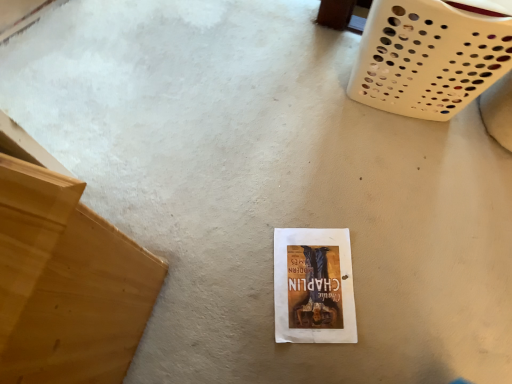
Locate an element on the screen. free space between light brown wood at left and white plastic basket at upper right is located at coordinates (253, 181).